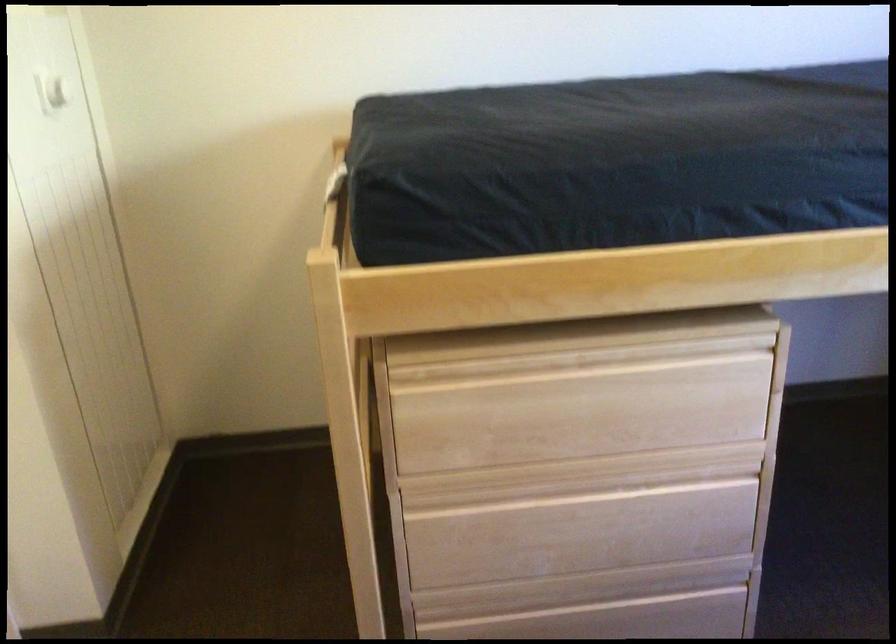
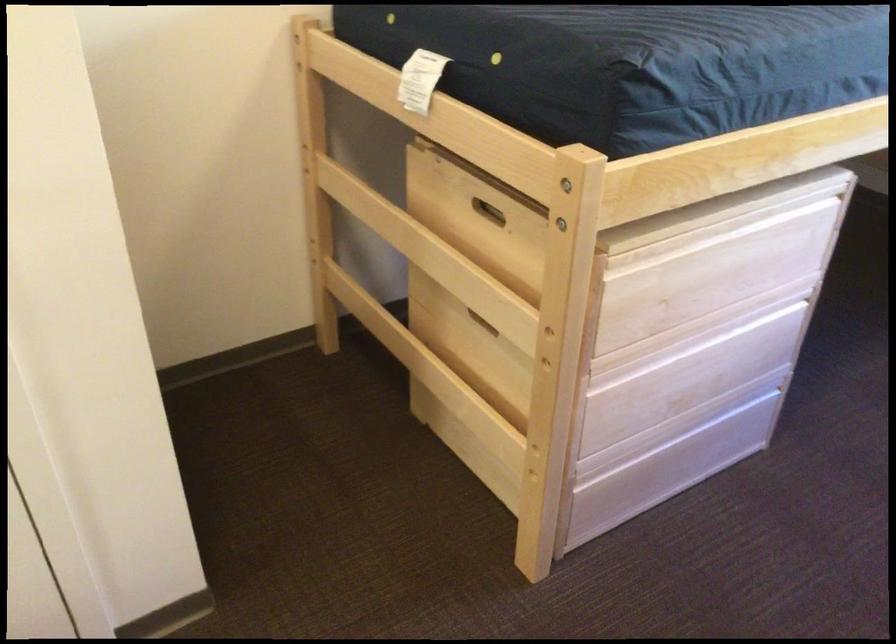
Locate, in the second image, the point that corresponds to the point at 609,495 in the first image.

(718, 342)